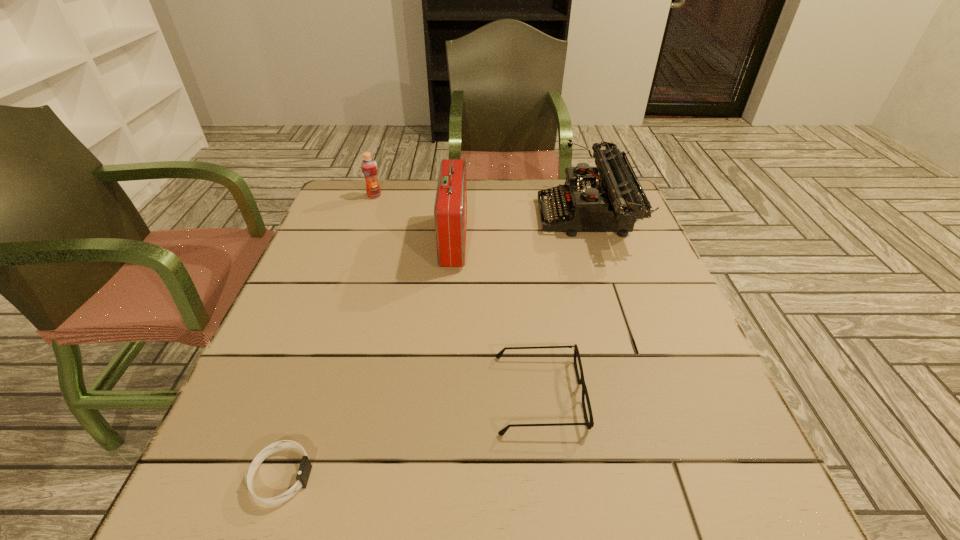
The width and height of the screenshot is (960, 540). Find the location of `blank space located 0.280m on the keyboard of the typewriter`. blank space located 0.280m on the keyboard of the typewriter is located at coordinates (438, 218).

Identify the location of blank space located on the keyboard of the typewriter. (489, 218).

Find the location of `vacant position located 0.120m on the right of the orange juice`. vacant position located 0.120m on the right of the orange juice is located at coordinates (422, 196).

Locate an element on the screen. Image resolution: width=960 pixels, height=540 pixels. free space located 0.160m on the front-facing side of the second nearest object is located at coordinates [671, 394].

Identify the location of free space located on the outer surface of the wristband. This screenshot has width=960, height=540. (368, 476).

Identify the location of the first-aid kit situated at the far edge. (450, 210).

Where is `typewriter present at the far edge`? The width and height of the screenshot is (960, 540). typewriter present at the far edge is located at coordinates (612, 202).

The width and height of the screenshot is (960, 540). In order to click on orange juice that is at the far edge in this screenshot , I will do `click(369, 166)`.

Where is `object that is positioned at the near edge`? This screenshot has width=960, height=540. object that is positioned at the near edge is located at coordinates (305, 467).

Locate an element on the screen. This screenshot has height=540, width=960. orange juice present at the left edge is located at coordinates (369, 166).